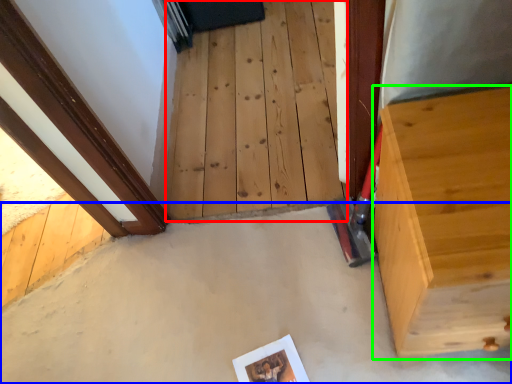
Question: Which object is the farthest from stairwell (highlighted by a red box)? Choose among these: concrete (highlighted by a blue box) or furniture (highlighted by a green box).

Choices:
 (A) concrete
 (B) furniture

Answer: (B)